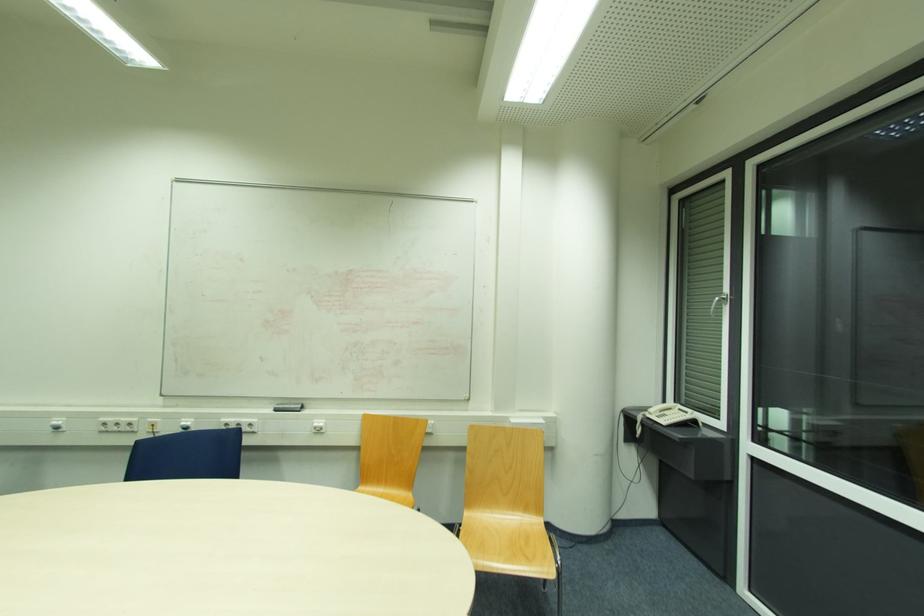
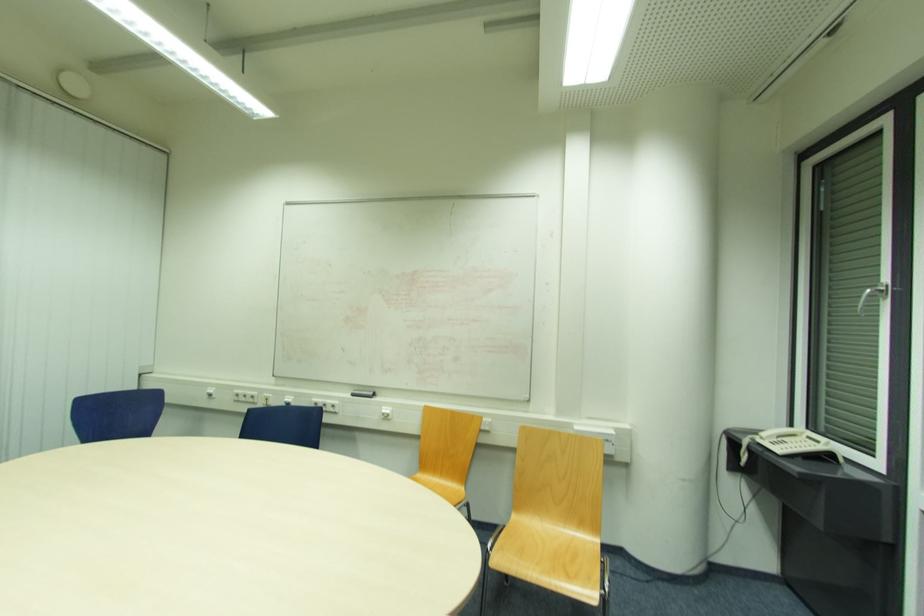
Question: I am providing you with two images of the same scene from different viewpoints. Please identify which objects are invisible in image2.

Choices:
 (A) white wall switch
 (B) silver window handle
 (C) white telephone handset
 (D) none of these

Answer: (D)